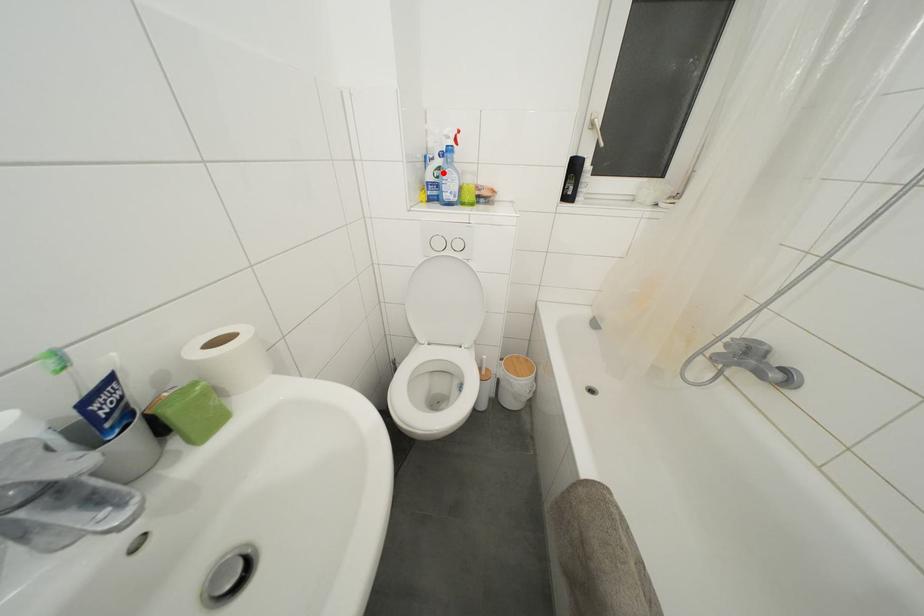
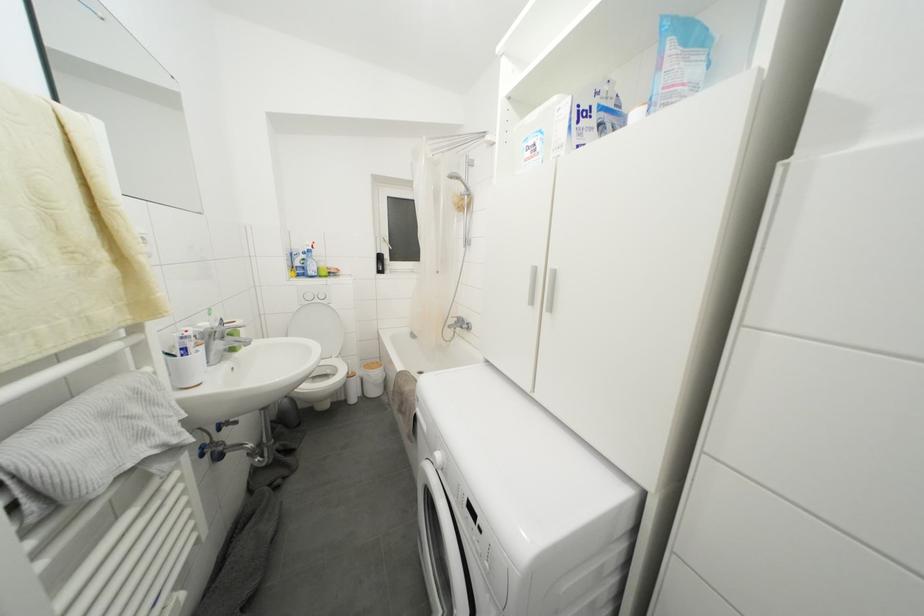
Locate, in the second image, the point that corresponds to the highlighted location in the first image.

(308, 264)